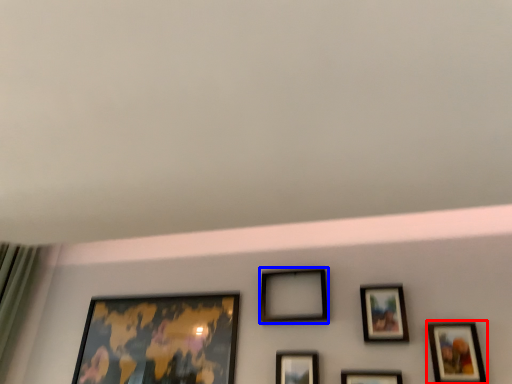
Question: Which of the following is the farthest to the observer, picture frame (highlighted by a red box) or picture frame (highlighted by a blue box)?

Choices:
 (A) picture frame
 (B) picture frame

Answer: (B)